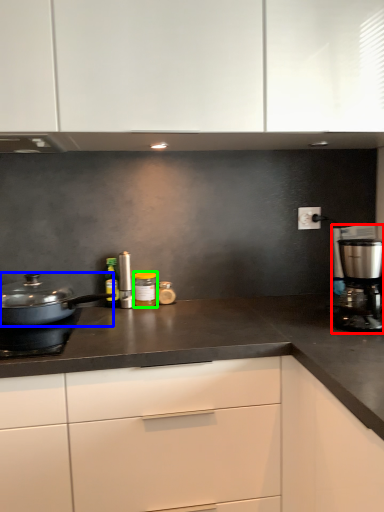
Question: Which object is the farthest from kitchen appliance (highlighted by a red box)? Choose among these: home appliance (highlighted by a blue box) or kitchen appliance (highlighted by a green box).

Choices:
 (A) home appliance
 (B) kitchen appliance

Answer: (A)